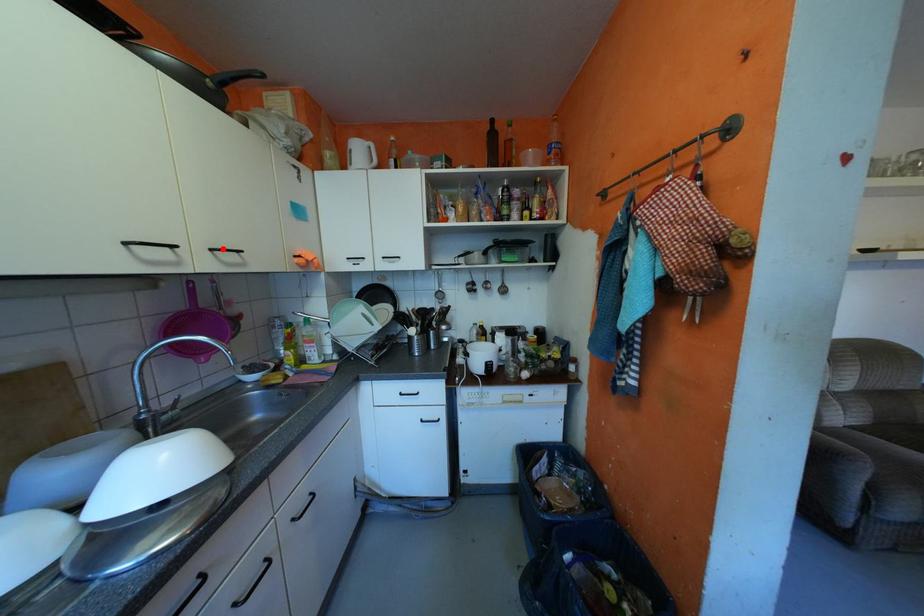
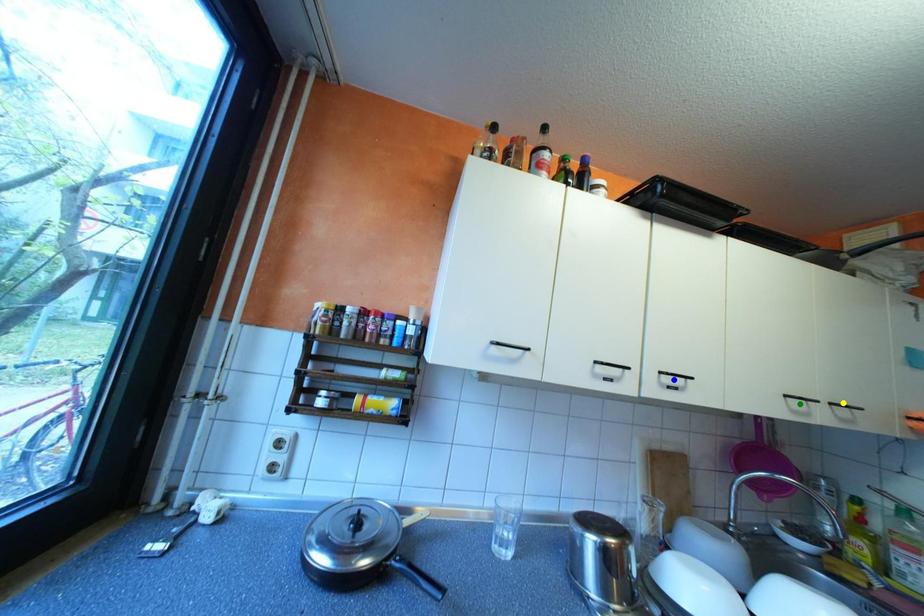
Question: I am providing you with two images of the same scene from different viewpoints. A red point is marked on the first image. You are given multiple points on the second image. In image 2, which mark is for the same physical point as the one in image 1?

Choices:
 (A) green point
 (B) yellow point
 (C) blue point

Answer: (B)